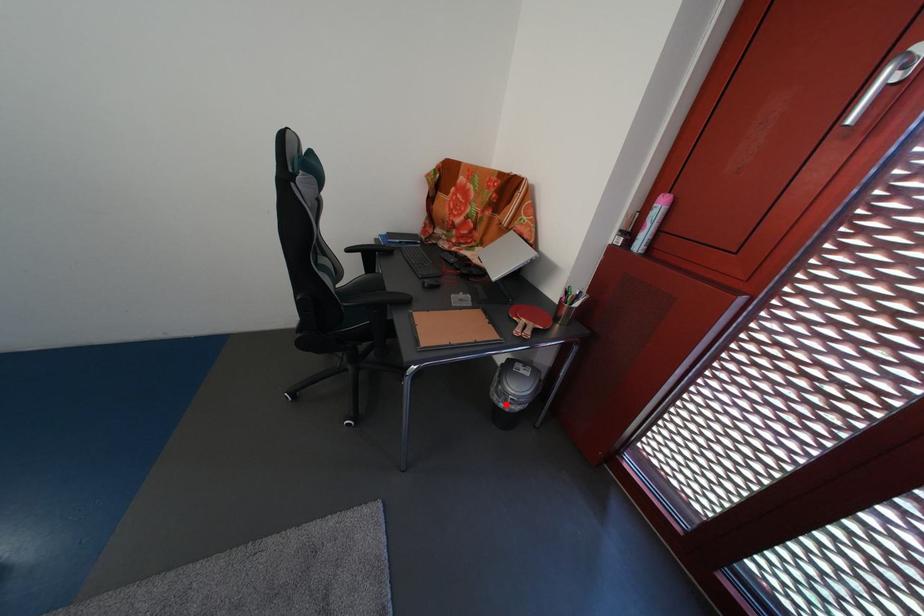
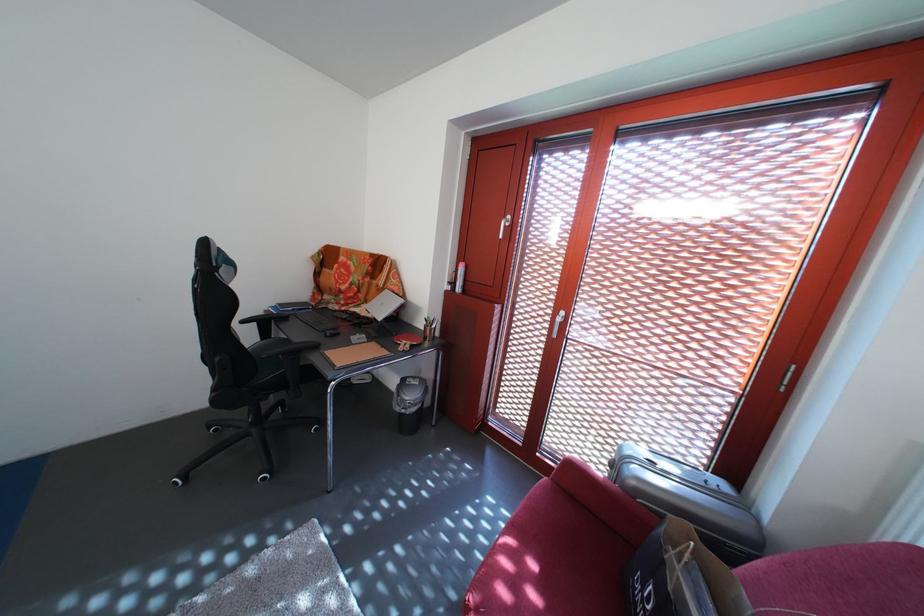
Question: I am providing you with two images of the same scene from different viewpoints. A red point is marked on the first image. Can you still see the location of the red point in image 2?

Choices:
 (A) Yes
 (B) No

Answer: (A)